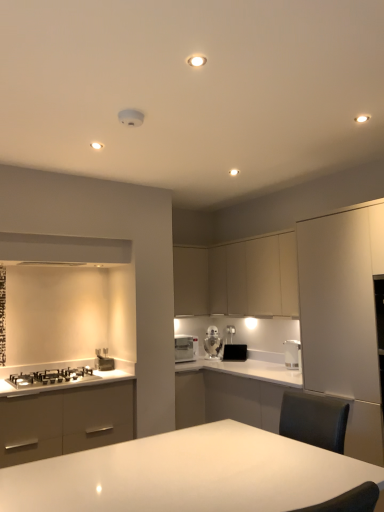
Image resolution: width=384 pixels, height=512 pixels. Find the location of `vacant area on top of black matte toaster at center, which ranks as the 1th appliance in back-to-front order (from a real-world perspective)`. vacant area on top of black matte toaster at center, which ranks as the 1th appliance in back-to-front order (from a real-world perspective) is located at coordinates (242, 343).